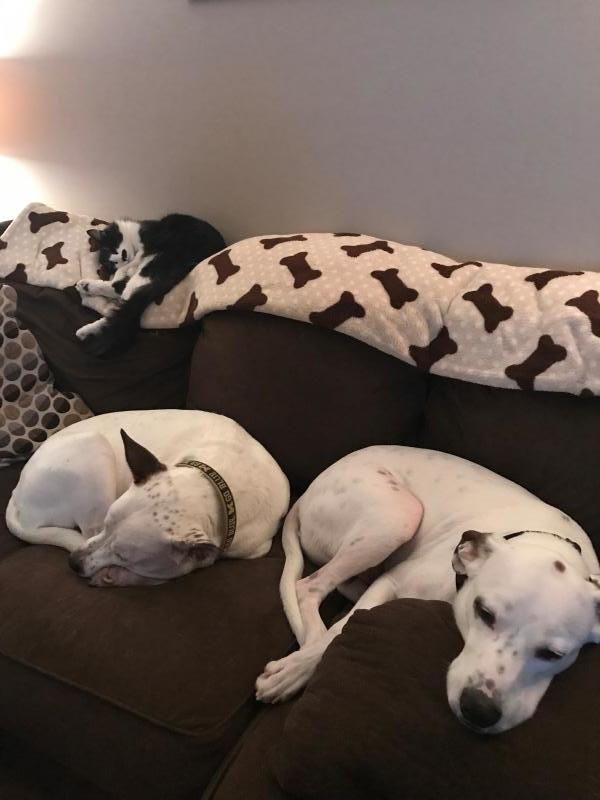
The height and width of the screenshot is (800, 600). In order to click on wall behind the couch in this screenshot , I will do `click(398, 140)`.